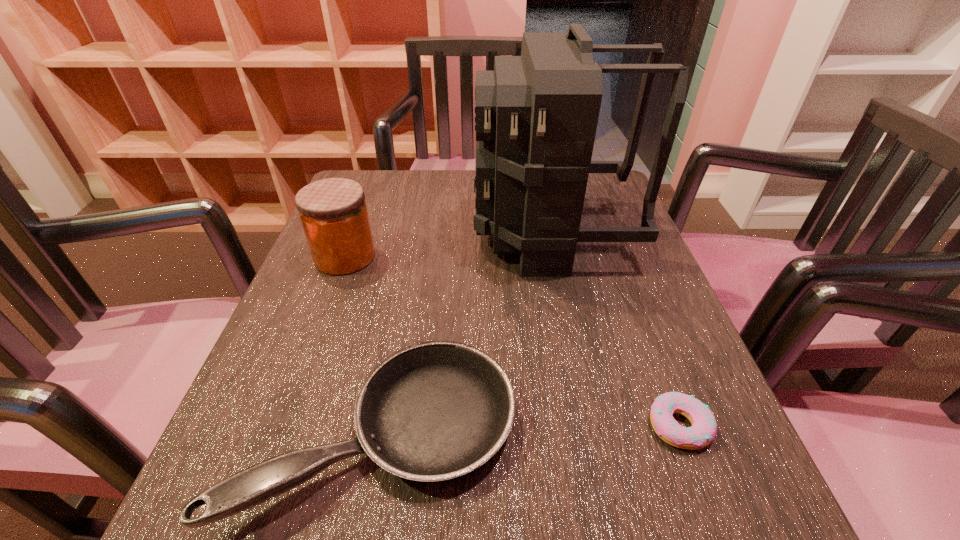
Locate an element on the screen. This screenshot has width=960, height=540. backpack that is at the right edge is located at coordinates (536, 115).

Identify the location of doughnut that is at the right edge. (702, 432).

Locate an element on the screen. object that is at the far right corner is located at coordinates (536, 115).

Identify the location of vacant space at the far edge. (431, 173).

Locate an element on the screen. free space at the near edge of the desktop is located at coordinates (416, 529).

Identify the location of vacant space at the left edge of the desktop. Image resolution: width=960 pixels, height=540 pixels. (258, 392).

This screenshot has height=540, width=960. I want to click on vacant region at the right edge, so click(590, 289).

In the image, there is a desktop. Where is `blank space at the far right corner`? blank space at the far right corner is located at coordinates (592, 180).

Identify the location of free space at the near right corner. The height and width of the screenshot is (540, 960). (663, 507).

Find the location of `free space between the doughnut and the backpack`. free space between the doughnut and the backpack is located at coordinates (615, 330).